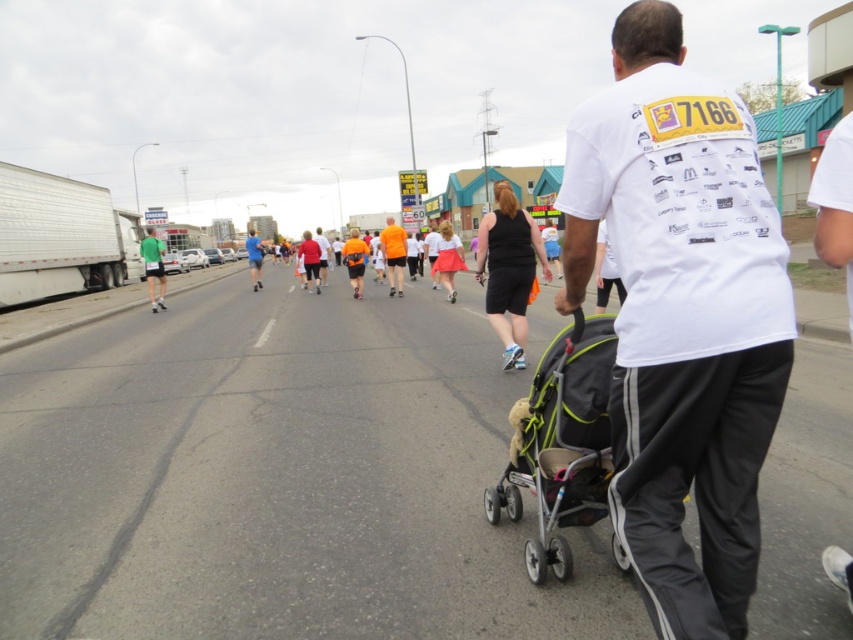
You are a participant in the race and you see the orange fabric shirt at center and the green fabric shorts at left. How far apart are they?

The orange fabric shirt at center and the green fabric shorts at left are 10.77 meters apart.

Based on the scene description, which object has a shorter height between the orange fabric shirt at center and the green fabric shorts at left?

The orange fabric shirt at center has a lesser height compared to the green fabric shorts at left.

You are a photographer standing at the starting line of the race. You want to take a photo that includes both the man with the stroller and another participant. The man with the stroller is at point (500, 502) and the other participant is at point (399, 243). Which participant will appear larger in your photo?

Point (500, 502) is closer to the camera than point (399, 243), so the man with the stroller at point (500, 502) will appear larger in the photo.